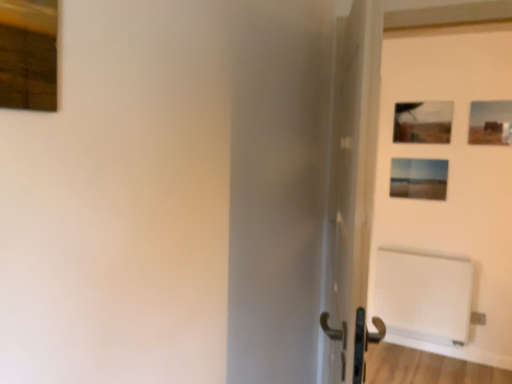
Question: Visually, is matte wooden picture frame at upper right, which is the 2th picture frame in front-to-back order, positioned to the left or to the right of matte black picture frame at upper right, which is the 2th picture frame in back-to-front order?

Choices:
 (A) left
 (B) right

Answer: (B)

Question: In terms of height, does matte wooden picture frame at upper right, arranged as the third picture frame when viewed from the back, look taller or shorter compared to matte black picture frame at upper right, marked as the second picture frame in a right-to-left arrangement?

Choices:
 (A) tall
 (B) short

Answer: (B)

Question: Which object is the farthest from the wooden frame at upper left, the 4th picture frame in the right-to-left sequence?

Choices:
 (A) matte wooden picture frame at center-right, placed as the 3th picture frame when sorted from right to left
 (B) white textured radiator at lower right
 (C) matte black picture frame at upper right, marked as the second picture frame in a right-to-left arrangement
 (D) matte wooden picture frame at upper right, arranged as the third picture frame when viewed from the back
 (E) white matte door at center

Answer: (B)

Question: Estimate the real-world distances between objects in this image. Which object is closer to the white textured radiator at lower right?

Choices:
 (A) white matte door at center
 (B) wooden frame at upper left, which ranks as the 1th picture frame in front-to-back order
 (C) matte wooden picture frame at center-right, positioned as the 1th picture frame in back-to-front order
 (D) matte black picture frame at upper right, which is the 3th picture frame from left to right
 (E) matte wooden picture frame at upper right, positioned as the 4th picture frame in left-to-right order

Answer: (C)